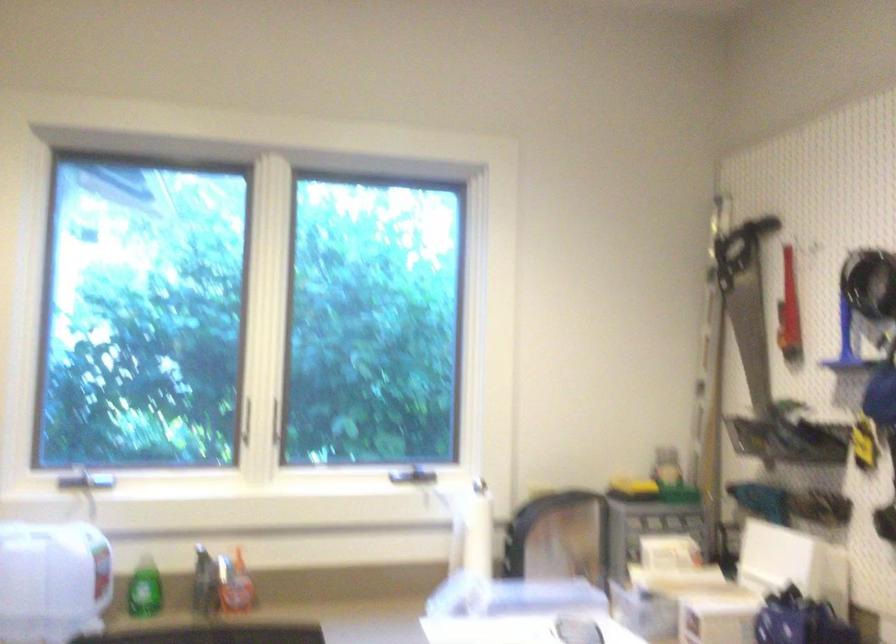
Locate an element on the screen. This screenshot has width=896, height=644. green bottle pump is located at coordinates (143, 589).